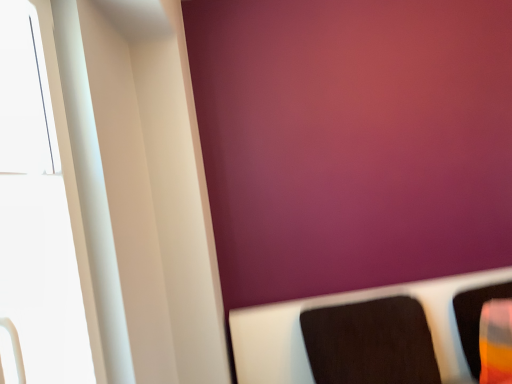
Question: Is translucent plastic cup at right, which is the second furniture in left-to-right order, smaller than black fabric cushion at lower right, which appears as the first furniture when viewed from the left?

Choices:
 (A) no
 (B) yes

Answer: (B)

Question: Could black fabric cushion at lower right, placed as the 2th furniture when sorted from right to left, be considered to be inside translucent plastic cup at right, the 1th furniture when ordered from right to left?

Choices:
 (A) no
 (B) yes

Answer: (A)

Question: Does translucent plastic cup at right, which is the second furniture in left-to-right order, have a lesser width compared to black fabric cushion at lower right, placed as the 2th furniture when sorted from right to left?

Choices:
 (A) no
 (B) yes

Answer: (B)

Question: From the image's perspective, is translucent plastic cup at right, the 1th furniture when ordered from right to left, beneath black fabric cushion at lower right, which appears as the first furniture when viewed from the left?

Choices:
 (A) yes
 (B) no

Answer: (B)

Question: Considering the relative positions of translucent plastic cup at right, which is the second furniture in left-to-right order, and black fabric cushion at lower right, placed as the 2th furniture when sorted from right to left, in the image provided, is translucent plastic cup at right, which is the second furniture in left-to-right order, to the left of black fabric cushion at lower right, placed as the 2th furniture when sorted from right to left, from the viewer's perspective?

Choices:
 (A) no
 (B) yes

Answer: (A)

Question: Considering the relative sizes of translucent plastic cup at right, the 1th furniture when ordered from right to left, and black fabric cushion at lower right, which appears as the first furniture when viewed from the left, in the image provided, is translucent plastic cup at right, the 1th furniture when ordered from right to left, shorter than black fabric cushion at lower right, which appears as the first furniture when viewed from the left,?

Choices:
 (A) no
 (B) yes

Answer: (B)

Question: Would you say black fabric cushion at lower right, which appears as the first furniture when viewed from the left, contains translucent plastic cup at right, which is the second furniture in left-to-right order?

Choices:
 (A) no
 (B) yes

Answer: (A)

Question: Is black fabric cushion at lower right, placed as the 2th furniture when sorted from right to left, thinner than translucent plastic cup at right, which is the second furniture in left-to-right order?

Choices:
 (A) yes
 (B) no

Answer: (B)

Question: Is black fabric cushion at lower right, which appears as the first furniture when viewed from the left, not near translucent plastic cup at right, which is the second furniture in left-to-right order?

Choices:
 (A) no
 (B) yes

Answer: (A)

Question: Is black fabric cushion at lower right, which appears as the first furniture when viewed from the left, in front of translucent plastic cup at right, the 1th furniture when ordered from right to left?

Choices:
 (A) no
 (B) yes

Answer: (B)

Question: Is black fabric cushion at lower right, placed as the 2th furniture when sorted from right to left, shorter than translucent plastic cup at right, the 1th furniture when ordered from right to left?

Choices:
 (A) yes
 (B) no

Answer: (B)

Question: From a real-world perspective, does black fabric cushion at lower right, placed as the 2th furniture when sorted from right to left, sit lower than translucent plastic cup at right, the 1th furniture when ordered from right to left?

Choices:
 (A) yes
 (B) no

Answer: (B)

Question: Is white glossy window at left far from translucent plastic cup at right, which is the second furniture in left-to-right order?

Choices:
 (A) yes
 (B) no

Answer: (A)